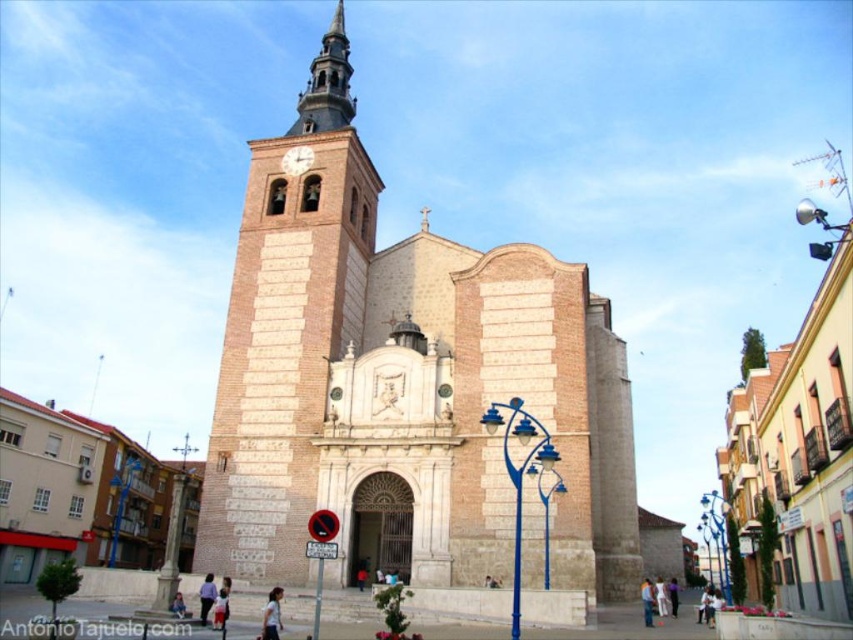
Question: Which object is farther from the camera taking this photo?

Choices:
 (A) light blue fabric shirt at lower center
 (B) matte white clock at center
 (C) denim jacket at lower center

Answer: (B)

Question: Is light blue fabric shirt at lower center further to the viewer compared to denim jacket at lower center?

Choices:
 (A) no
 (B) yes

Answer: (A)

Question: Which point is farther to the camera?

Choices:
 (A) (177, 611)
 (B) (267, 477)
 (C) (264, 609)

Answer: (B)

Question: Estimate the real-world distances between objects in this image. Which object is farther from the matte white clock at center?

Choices:
 (A) denim jacket at lower center
 (B) brown stone clock tower at center
 (C) beige stone church at center
 (D) light blue jeans at center

Answer: (A)

Question: Is light blue fabric shirt at lower center to the left of matte white clock at center from the viewer's perspective?

Choices:
 (A) yes
 (B) no

Answer: (B)

Question: Does brown stone clock tower at center lie in front of denim jacket at lower center?

Choices:
 (A) yes
 (B) no

Answer: (B)